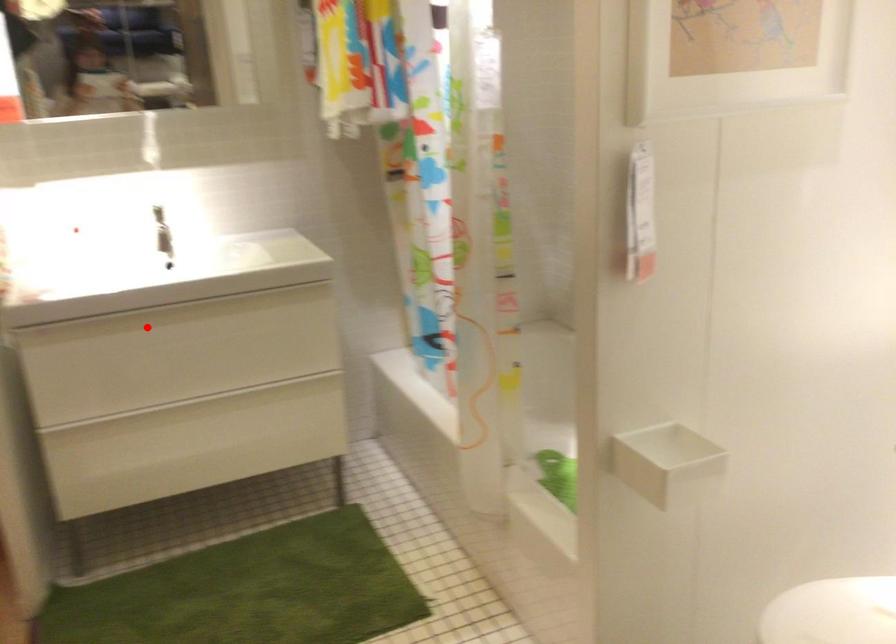
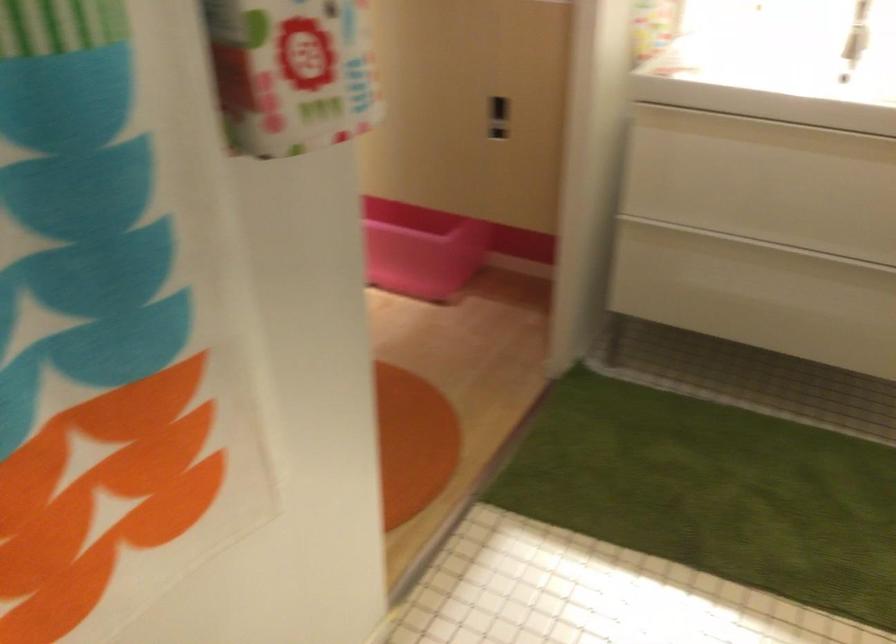
Question: I am providing you with two images of the same scene from different viewpoints. Given a red point in image1, look at the same physical point in image2. Is it:

Choices:
 (A) Closer to the viewpoint
 (B) Farther from the viewpoint

Answer: (A)